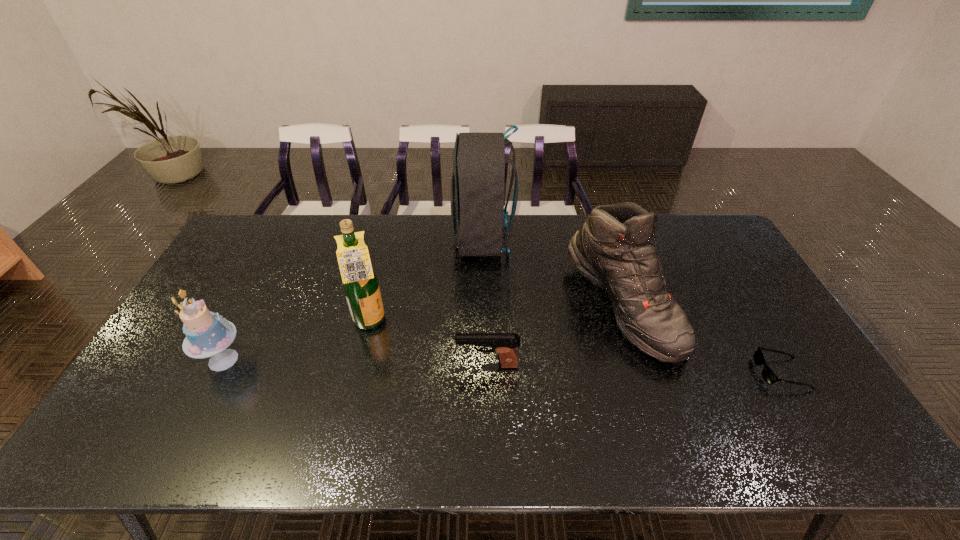
Locate an element on the screen. This screenshot has width=960, height=540. free spot located on the front-facing side of the tallest object is located at coordinates (349, 240).

At what (x,y) coordinates should I click in order to perform the action: click on free location located on the front-facing side of the second object from left to right. Please return your answer as a coordinate pair (x, y). The image size is (960, 540). Looking at the image, I should click on [452, 322].

What are the coordinates of `vacant region located on the right of the ski boot` in the screenshot? It's located at (713, 305).

I want to click on vacant space positioned with a ladder on the side of the third shortest object, so click(279, 360).

You are a GUI agent. You are given a task and a screenshot of the screen. Output one action in this format:
    pyautogui.click(x=<x>, y=<y>)
    Task: Click on the vacant space located 0.230m at the barrel of the pistol
    This screenshot has height=540, width=960.
    Given the screenshot: What is the action you would take?
    pyautogui.click(x=372, y=365)

Locate an element on the screen. free region located 0.340m at the barrel of the pistol is located at coordinates (330, 365).

Locate an element on the screen. blank area located at the barrel of the pistol is located at coordinates (338, 365).

Where is `vacant space located on the front-facing side of the rightmost object`? The image size is (960, 540). vacant space located on the front-facing side of the rightmost object is located at coordinates (732, 373).

This screenshot has width=960, height=540. In order to click on free region located 0.090m on the front-facing side of the rightmost object in this screenshot , I will do `click(725, 373)`.

At what (x,y) coordinates should I click in order to perform the action: click on free space located 0.180m on the front-facing side of the rightmost object. Please return your answer as a coordinate pair (x, y). This screenshot has width=960, height=540. Looking at the image, I should click on pyautogui.click(x=690, y=373).